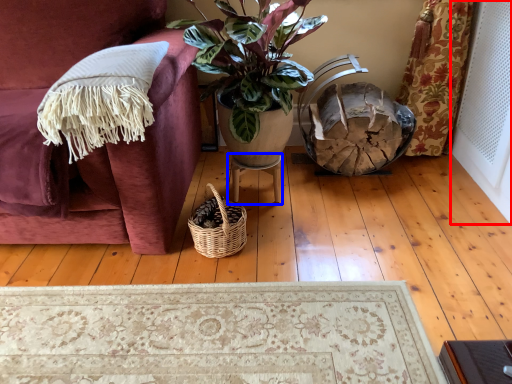
Question: Among these objects, which one is farthest to the camera, screen door (highlighted by a red box) or table (highlighted by a blue box)?

Choices:
 (A) screen door
 (B) table

Answer: (B)